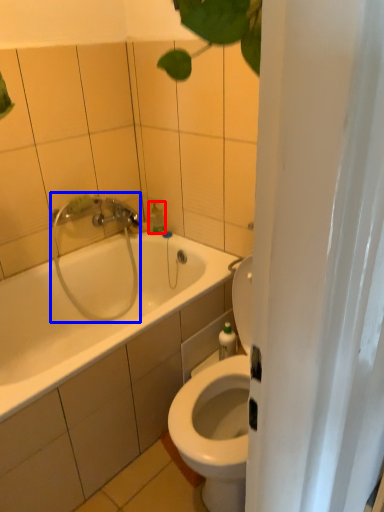
Question: Which of the following is the farthest to the observer, soap dispenser (highlighted by a red box) or shower (highlighted by a blue box)?

Choices:
 (A) soap dispenser
 (B) shower

Answer: (A)